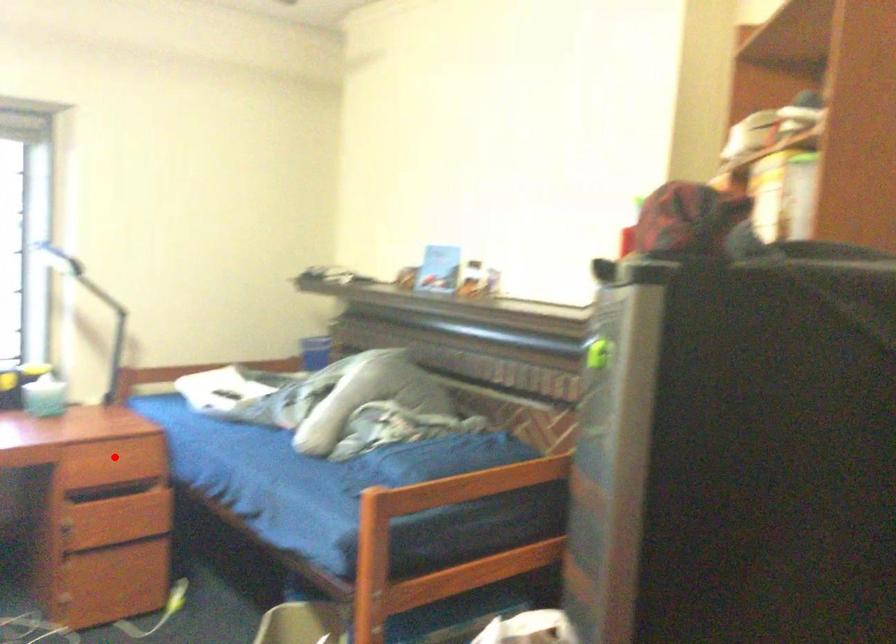
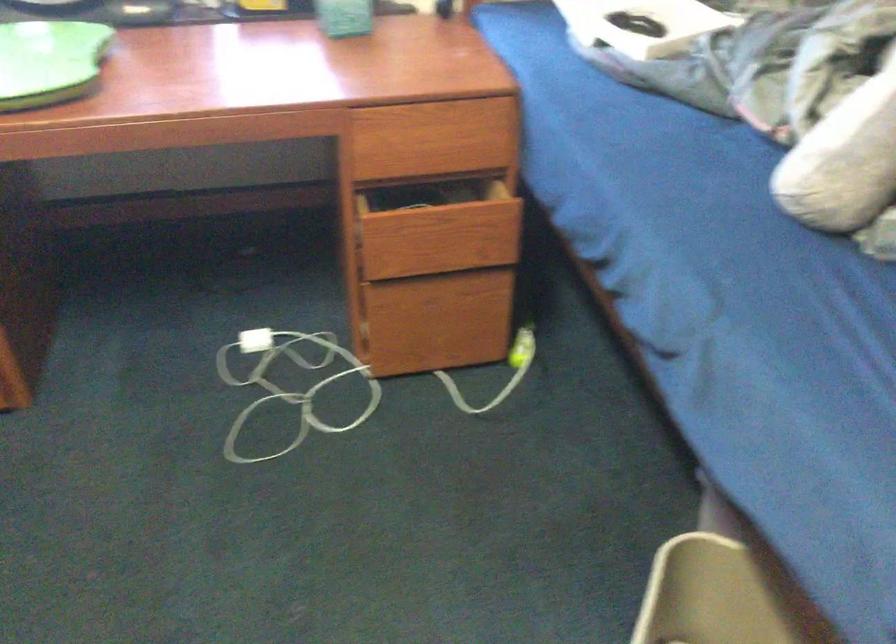
Question: I am providing you with two images of the same scene from different viewpoints. Given a red point in image1, look at the same physical point in image2. Is it:

Choices:
 (A) Closer to the viewpoint
 (B) Farther from the viewpoint

Answer: (A)